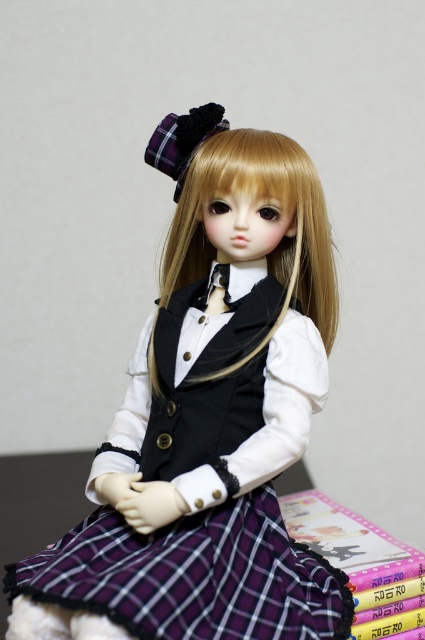
Question: Does plaid fabric dress at center have a lesser width compared to plastic book at lower right?

Choices:
 (A) yes
 (B) no

Answer: (B)

Question: Which object is closer to the camera taking this photo?

Choices:
 (A) plastic book at lower right
 (B) plaid fabric dress at center

Answer: (B)

Question: Can you confirm if plaid fabric dress at center is positioned above plastic book at lower right?

Choices:
 (A) yes
 (B) no

Answer: (A)

Question: Can you confirm if plaid fabric dress at center is positioned to the right of plastic book at lower right?

Choices:
 (A) yes
 (B) no

Answer: (B)